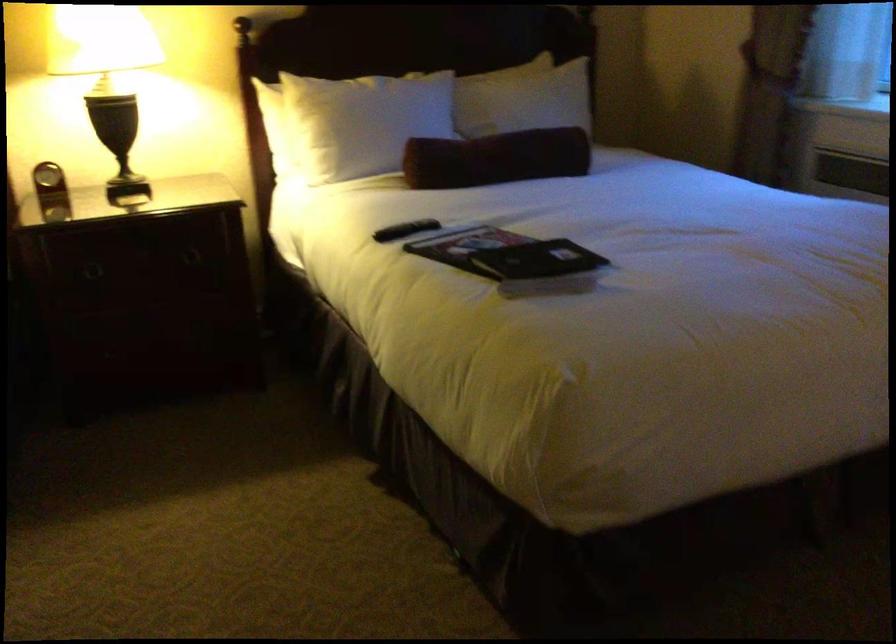
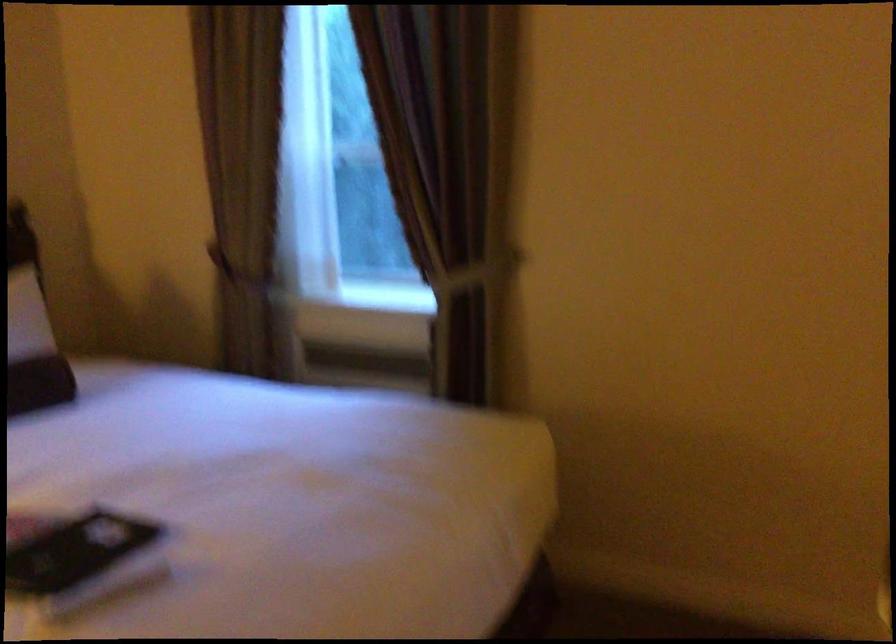
Question: The first image is from the beginning of the video and the second image is from the end. How did the camera likely rotate when shooting the video?

Choices:
 (A) Left
 (B) Right
 (C) Up
 (D) Down

Answer: (B)